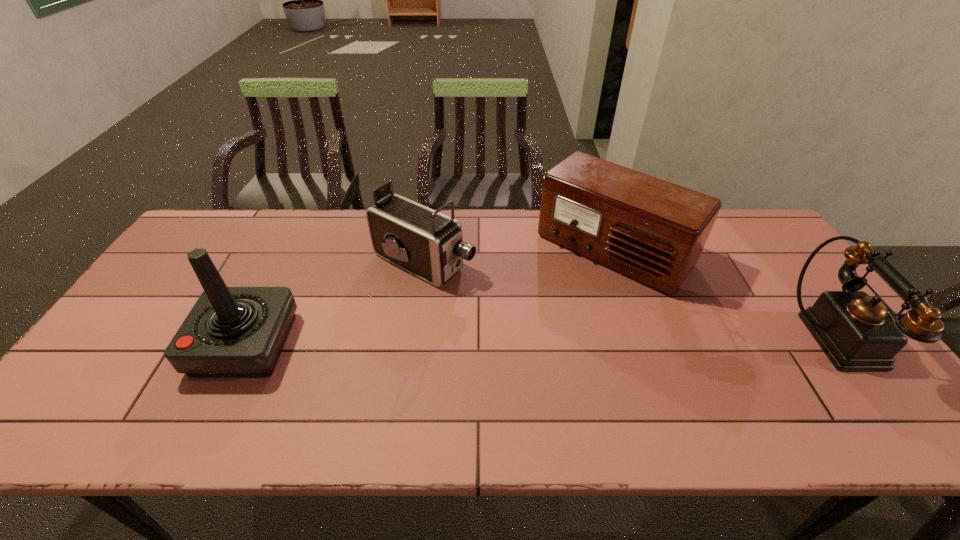
Where is `the tallest object`? The width and height of the screenshot is (960, 540). the tallest object is located at coordinates (231, 332).

Identify the location of the leftmost object. The image size is (960, 540). (231, 332).

The height and width of the screenshot is (540, 960). I want to click on the rightmost object, so click(856, 332).

Locate an element on the screen. the second object from left to right is located at coordinates (428, 244).

Locate an element on the screen. The image size is (960, 540). the third object from left to right is located at coordinates (653, 231).

Find the location of a particular element. The height and width of the screenshot is (540, 960). vacant space located on the front-facing side of the leftmost object is located at coordinates (122, 345).

This screenshot has height=540, width=960. Identify the location of vacant position located on the front-facing side of the leftmost object. (127, 345).

Identify the location of vacant region located 0.080m on the front-facing side of the leftmost object. The image size is (960, 540). (170, 345).

Locate an element on the screen. vacant space located at the lens of the camcorder is located at coordinates (515, 302).

This screenshot has width=960, height=540. I want to click on free space located at the lens of the camcorder, so click(x=500, y=295).